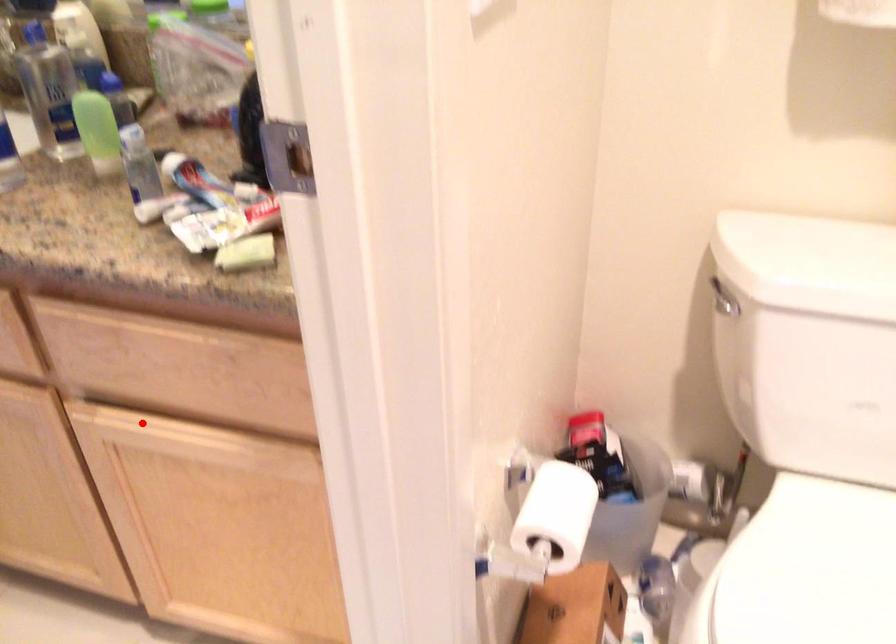
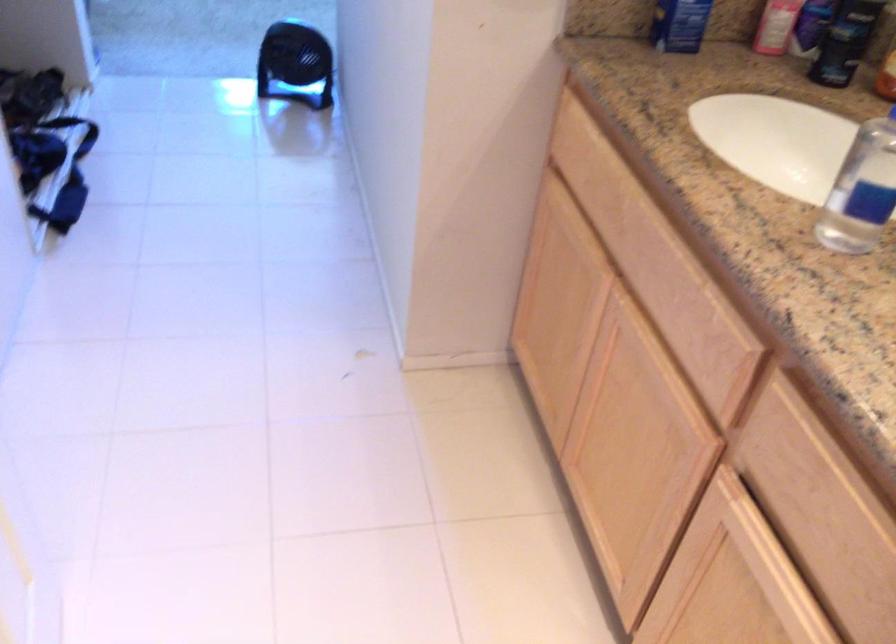
Locate, in the second image, the point that corresponds to the highlighted location in the first image.

(754, 536)